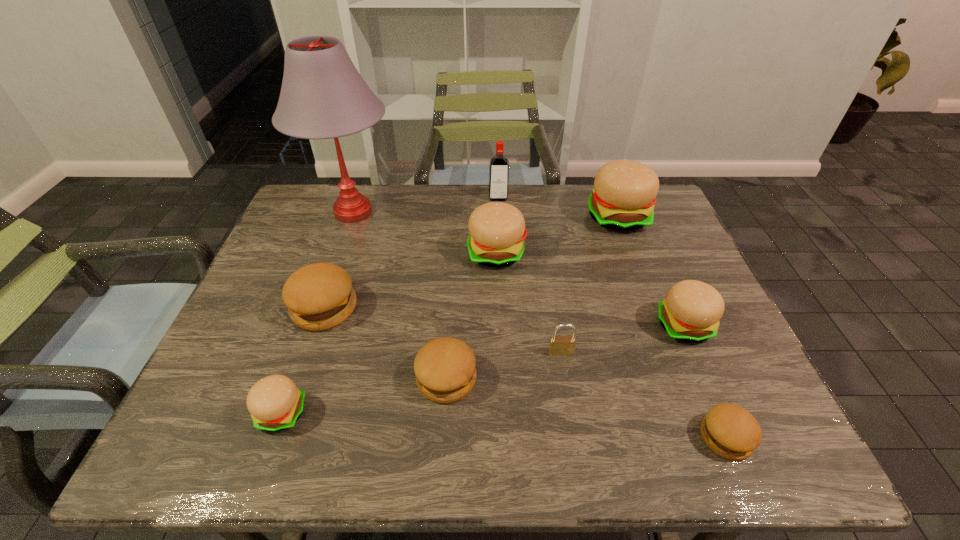
You are a GUI agent. You are given a task and a screenshot of the screen. Output one action in this format:
    pyautogui.click(x=<x>, y=<y>)
    Task: Click on the vacant point located 0.340m on the left of the tallest hamburger
    Image resolution: width=960 pixels, height=540 pixels.
    Given the screenshot: What is the action you would take?
    pyautogui.click(x=477, y=217)

Locate an element on the screen. This screenshot has height=540, width=960. free region located on the back of the second biggest beige hamburger is located at coordinates (495, 224).

This screenshot has width=960, height=540. Find the location of `free space located on the front of the second nearest beige hamburger`. free space located on the front of the second nearest beige hamburger is located at coordinates (732, 439).

At what (x,y) coordinates should I click in order to perform the action: click on free space located 0.210m on the right of the biggest brown hamburger. Please return your answer as a coordinate pair (x, y). The image size is (960, 540). Looking at the image, I should click on (442, 308).

The height and width of the screenshot is (540, 960). Identify the location of vacant point located 0.220m on the front-facing side of the brass padlock. (576, 451).

Where is `free space located 0.250m on the back of the second biggest brown hamburger`? This screenshot has width=960, height=540. free space located 0.250m on the back of the second biggest brown hamburger is located at coordinates (453, 277).

Find the location of a particular element. vacant point located on the back of the smallest beige hamburger is located at coordinates (331, 272).

Find the location of a particular element. Image resolution: width=960 pixels, height=540 pixels. free space located on the left of the shortest object is located at coordinates [x=571, y=437].

In order to click on table lamp positioned at the far edge in this screenshot , I will do `click(323, 96)`.

The height and width of the screenshot is (540, 960). I want to click on vodka that is at the far edge, so click(498, 189).